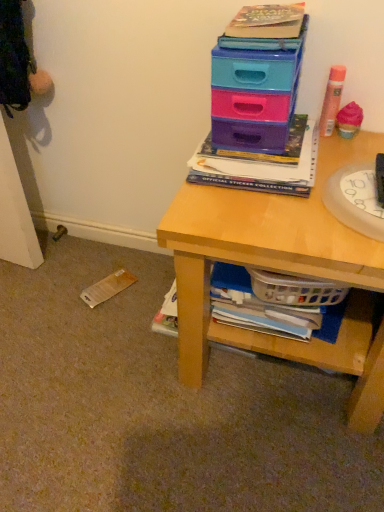
Where is `vacant space positioned to the left of wooden desk at upper right`? Image resolution: width=384 pixels, height=512 pixels. vacant space positioned to the left of wooden desk at upper right is located at coordinates (101, 343).